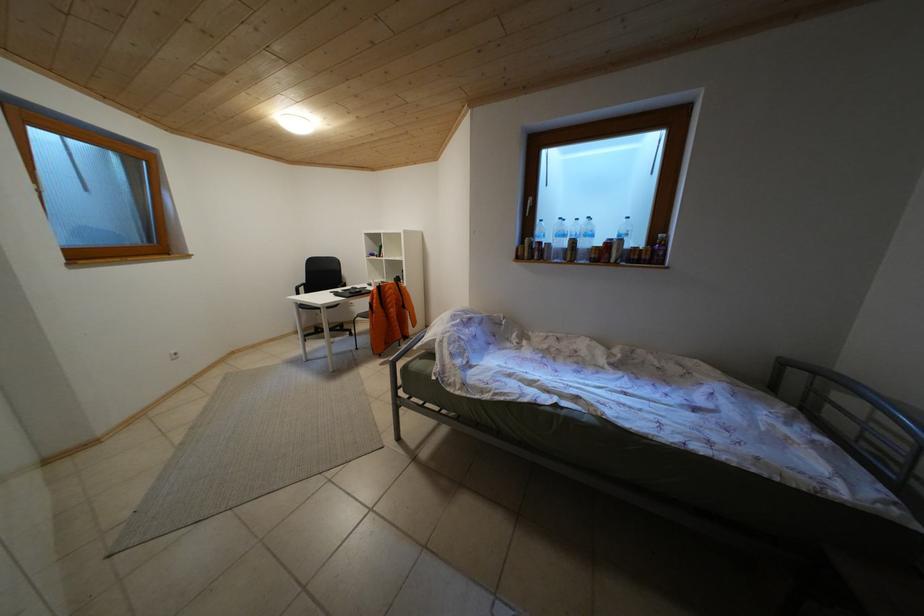
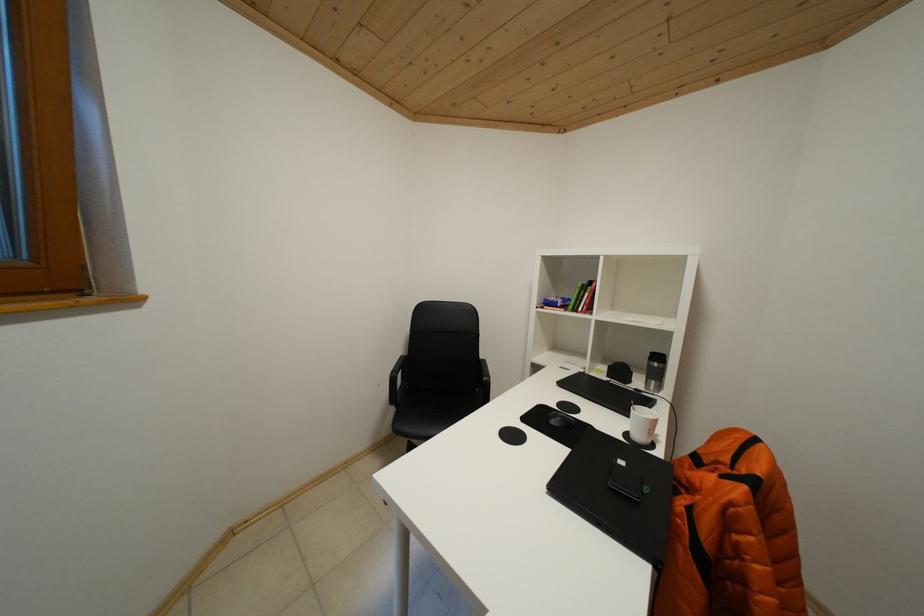
In a continuous first-person perspective shot, in which direction is the camera moving?

The cameraman moved toward left, forward.